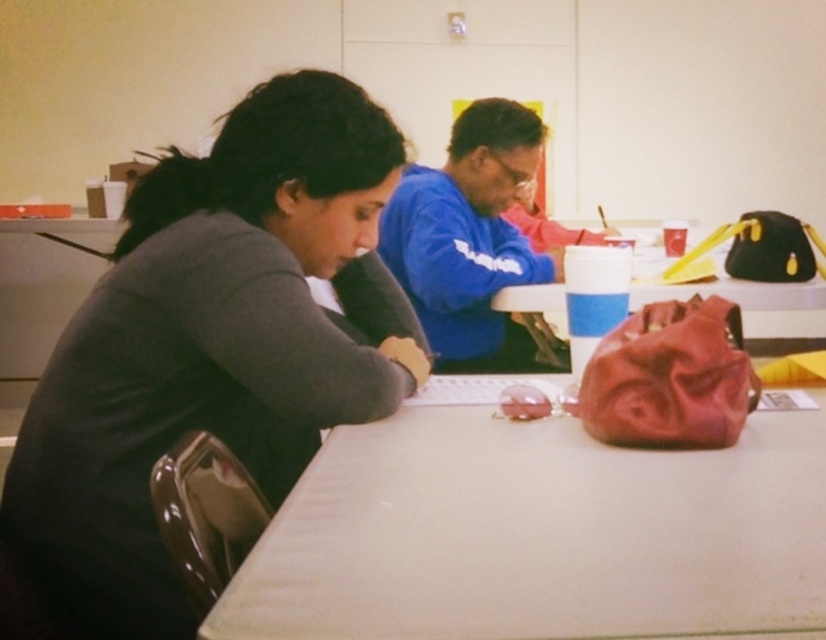
Question: Considering the real-world distances, which object is farthest from the rubberized red bag at center?

Choices:
 (A) white matte table at center
 (B) blue fleece sweatshirt at center

Answer: (A)

Question: Estimate the real-world distances between objects in this image. Which object is closer to the rubberized red bag at center?

Choices:
 (A) blue fleece sweatshirt at center
 (B) white matte table at center
 (C) dark gray sweater at center

Answer: (A)

Question: Estimate the real-world distances between objects in this image. Which object is farther from the rubberized red bag at center?

Choices:
 (A) white matte table at center
 (B) dark gray sweater at center

Answer: (A)

Question: Does white matte table at center have a smaller size compared to blue fleece sweatshirt at center?

Choices:
 (A) yes
 (B) no

Answer: (A)

Question: Considering the relative positions of blue fleece sweatshirt at center and rubberized red bag at center in the image provided, where is blue fleece sweatshirt at center located with respect to rubberized red bag at center?

Choices:
 (A) left
 (B) right

Answer: (A)

Question: Does dark gray sweater at center appear under white matte table at center?

Choices:
 (A) no
 (B) yes

Answer: (A)